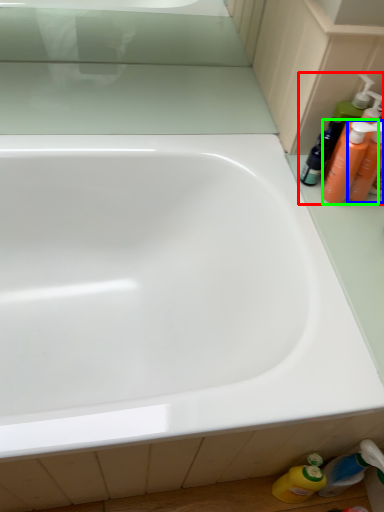
Question: Based on their relative distances, which object is nearer to toiletry (highlighted by a red box)? Choose from toiletry (highlighted by a blue box) and cleaning product (highlighted by a green box).

Choices:
 (A) toiletry
 (B) cleaning product

Answer: (B)